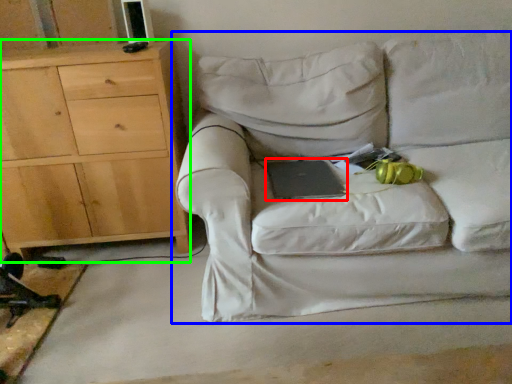
Question: Considering the real-world distances, which object is farthest from paperback book (highlighted by a red box)? studio couch (highlighted by a blue box) or chest of drawers (highlighted by a green box)?

Choices:
 (A) studio couch
 (B) chest of drawers

Answer: (B)